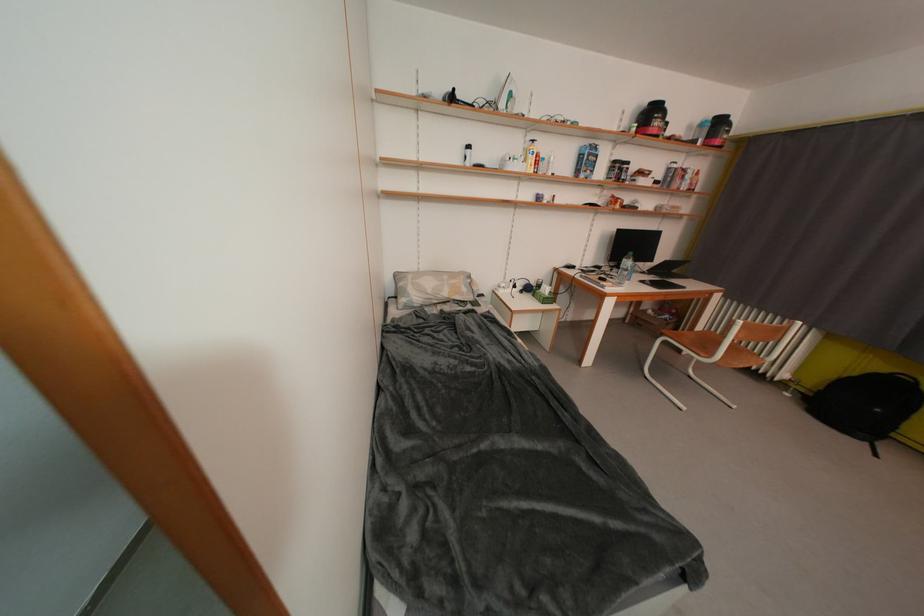
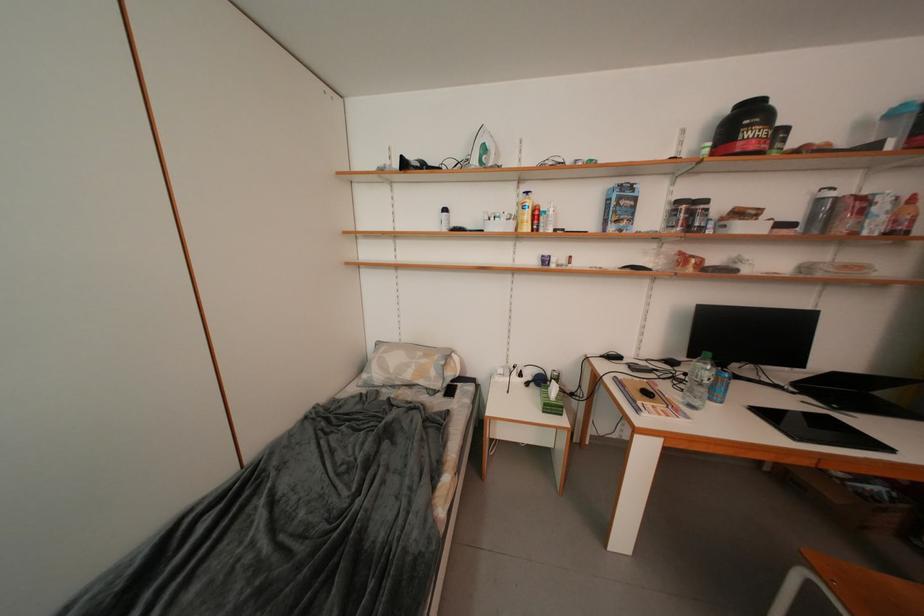
The images are taken continuously from a first-person perspective. In which direction are you moving?

The cameraman moved toward right, forward.